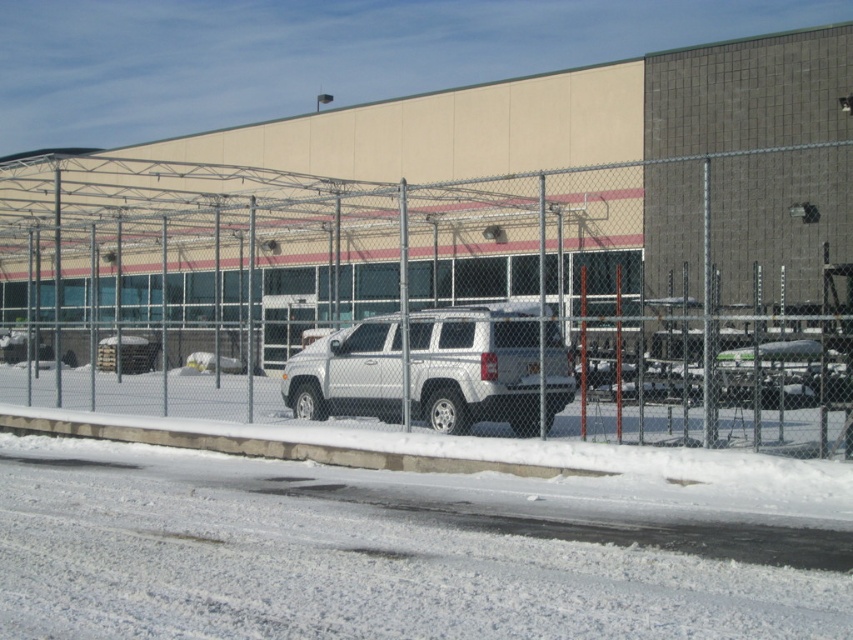
You are standing in front of the fence and want to place a small flag at each of the two points marked in the image. If you first place the flag at point (410, 406), will the flag at point (483, 419) be visible from your current position behind the fence?

Point (483, 419) is behind point (410, 406), so the flag placed at point (483, 419) will not be visible from your current position behind the fence because it is obscured by the first flag at point (410, 406).